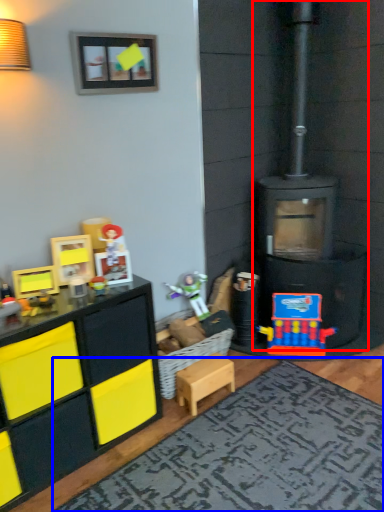
Question: Which point is closer to the camera, fireplace (highlighted by a red box) or mat (highlighted by a blue box)?

Choices:
 (A) fireplace
 (B) mat

Answer: (B)